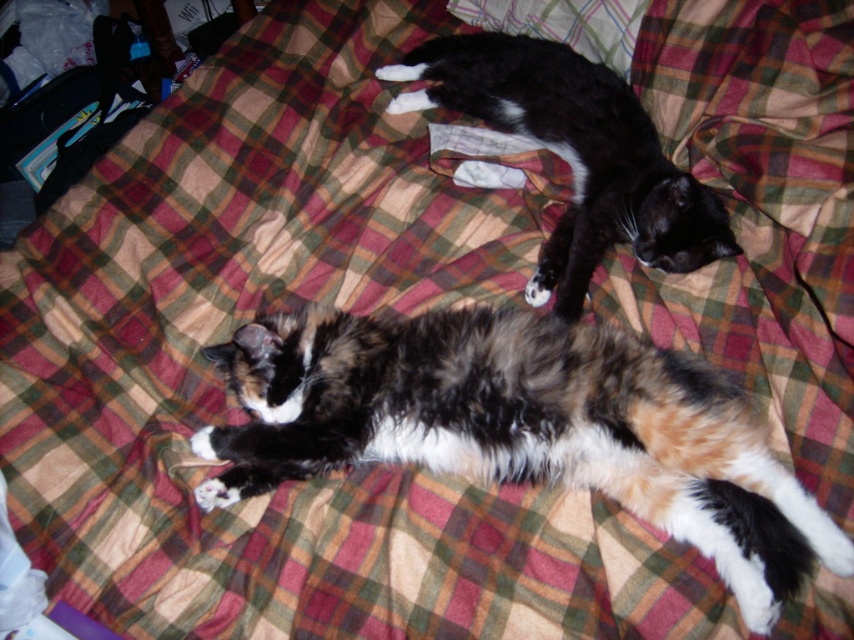
Is calico fur cat at center closer to camera compared to black fur cat at upper center?

Yes, calico fur cat at center is closer to the viewer.

Between point (408, 360) and point (658, 157), which one is positioned behind?

The point (658, 157) is more distant.

You are a GUI agent. You are given a task and a screenshot of the screen. Output one action in this format:
    pyautogui.click(x=<x>, y=<y>)
    Task: Click on the calico fur cat at center
    This screenshot has height=640, width=854.
    Given the screenshot: What is the action you would take?
    pyautogui.click(x=524, y=428)